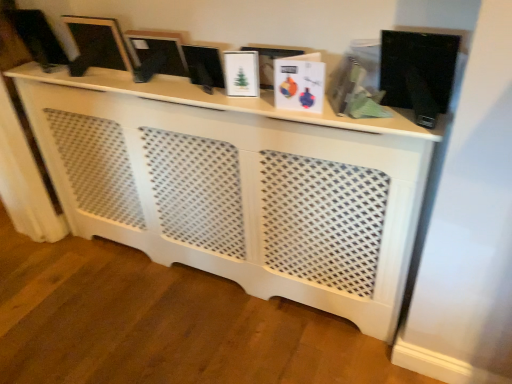
Question: Is matte black monitor at upper left, marked as the 3th computer monitor in a right-to-left arrangement, surrounded by black glossy computer monitor at center, arranged as the 1th computer monitor when viewed from the right?

Choices:
 (A) yes
 (B) no

Answer: (B)

Question: From the image's perspective, would you say black glossy computer monitor at center, arranged as the 1th computer monitor when viewed from the right, is shown under matte black monitor at upper left, which is the 1th computer monitor in left-to-right order?

Choices:
 (A) no
 (B) yes

Answer: (B)

Question: Is black glossy computer monitor at center, arranged as the 1th computer monitor when viewed from the right, behind matte black monitor at upper left, marked as the 3th computer monitor in a right-to-left arrangement?

Choices:
 (A) no
 (B) yes

Answer: (A)

Question: Does black glossy computer monitor at center, which is the 3th computer monitor from left to right, have a smaller size compared to matte black monitor at upper left, which is the 1th computer monitor in left-to-right order?

Choices:
 (A) yes
 (B) no

Answer: (A)

Question: Is black glossy computer monitor at center, arranged as the 1th computer monitor when viewed from the right, wider than matte black monitor at upper left, marked as the 3th computer monitor in a right-to-left arrangement?

Choices:
 (A) no
 (B) yes

Answer: (A)

Question: Looking at their shapes, would you say matte black frame at upper left, the second computer monitor viewed from the right, is wider or thinner than matte black monitor at upper left, marked as the 3th computer monitor in a right-to-left arrangement?

Choices:
 (A) wide
 (B) thin

Answer: (B)

Question: From the image's perspective, is matte black frame at upper left, the second computer monitor viewed from the right, above or below matte black monitor at upper left, which is the 1th computer monitor in left-to-right order?

Choices:
 (A) above
 (B) below

Answer: (B)

Question: Would you say matte black frame at upper left, the second computer monitor viewed from the left, is inside or outside matte black monitor at upper left, which is the 1th computer monitor in left-to-right order?

Choices:
 (A) inside
 (B) outside

Answer: (B)

Question: From their relative heights in the image, would you say matte black frame at upper left, the second computer monitor viewed from the right, is taller or shorter than matte black monitor at upper left, marked as the 3th computer monitor in a right-to-left arrangement?

Choices:
 (A) short
 (B) tall

Answer: (A)

Question: Looking at the image, does white lattice cabinet at center seem bigger or smaller compared to matte black monitor at upper left, which is the 1th computer monitor in left-to-right order?

Choices:
 (A) small
 (B) big

Answer: (B)

Question: Is white lattice cabinet at center in front of or behind matte black monitor at upper left, marked as the 3th computer monitor in a right-to-left arrangement, in the image?

Choices:
 (A) behind
 (B) front

Answer: (B)

Question: Do you think white lattice cabinet at center is within matte black monitor at upper left, which is the 1th computer monitor in left-to-right order, or outside of it?

Choices:
 (A) outside
 (B) inside

Answer: (A)

Question: In terms of width, does white lattice cabinet at center look wider or thinner when compared to matte black monitor at upper left, which is the 1th computer monitor in left-to-right order?

Choices:
 (A) wide
 (B) thin

Answer: (A)

Question: Considering the positions of point (207, 92) and point (50, 41), is point (207, 92) closer or farther from the camera than point (50, 41)?

Choices:
 (A) closer
 (B) farther

Answer: (A)

Question: Is black glossy computer monitor at center, which is the 3th computer monitor from left to right, bigger or smaller than matte black monitor at upper left, marked as the 3th computer monitor in a right-to-left arrangement?

Choices:
 (A) small
 (B) big

Answer: (A)